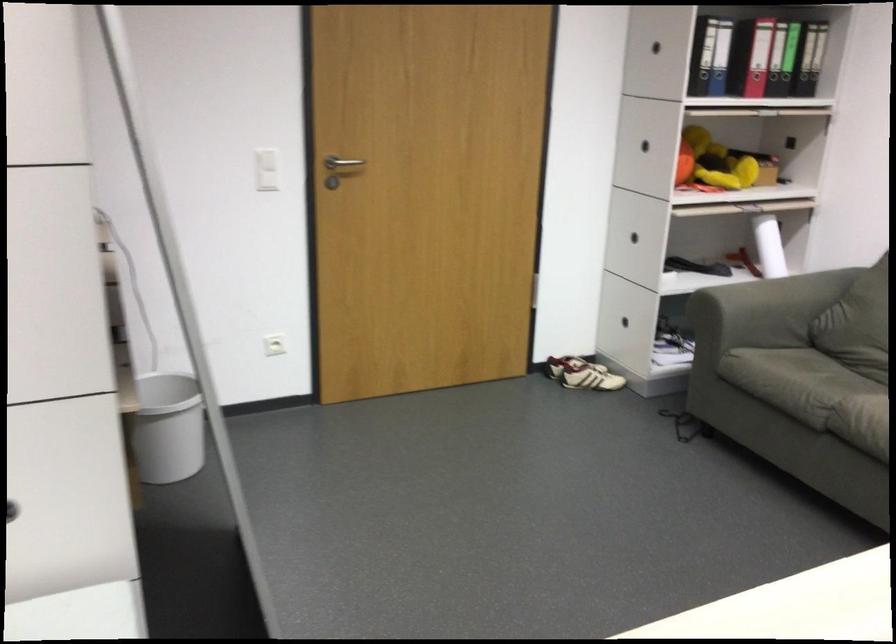
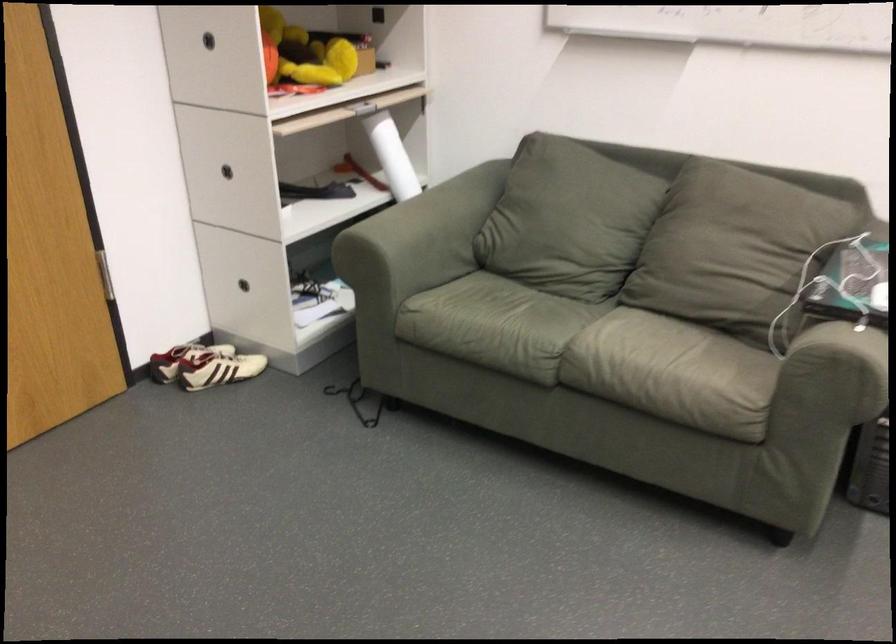
Where in the second image is the point corresponding to point 762,240 from the first image?

(392, 156)